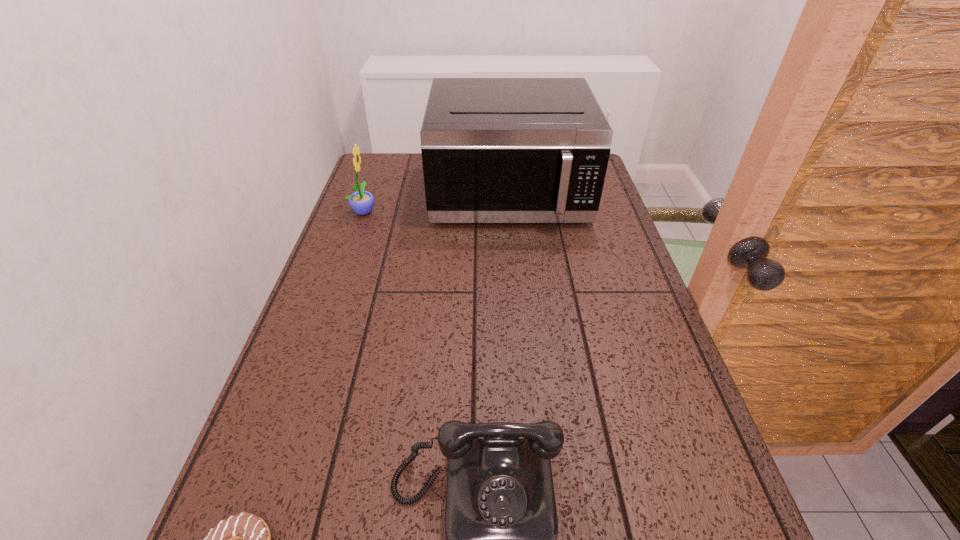
In the image, there is a desktop. Where is `vacant space at the far left corner`? The image size is (960, 540). vacant space at the far left corner is located at coordinates (376, 159).

The height and width of the screenshot is (540, 960). Identify the location of object that ranks as the closest to the second shortest object. (244, 539).

I want to click on the closest object relative to the sunflower, so click(x=494, y=150).

The image size is (960, 540). Identify the location of free location that satisfies the following two spatial constraints: 1. on the front-facing side of the tallest object; 2. on the front-facing side of the second tallest object. point(510,211).